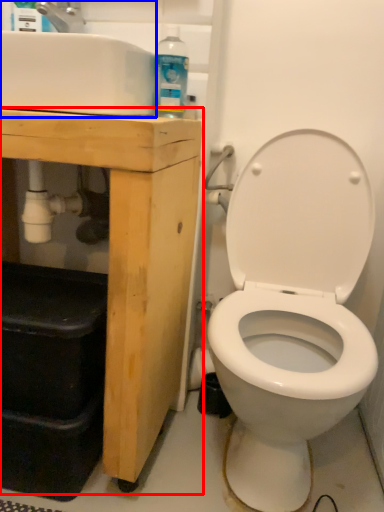
Question: Among these objects, which one is nearest to the camera, porcelain (highlighted by a red box) or sink (highlighted by a blue box)?

Choices:
 (A) porcelain
 (B) sink

Answer: (B)